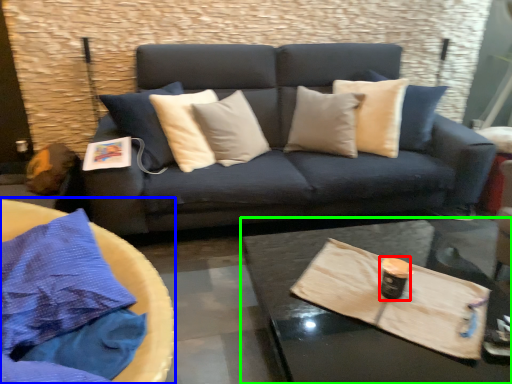
Question: Which object is the farthest from beverage (highlighted by a red box)? Choose among these: round table (highlighted by a blue box) or coffee table (highlighted by a green box).

Choices:
 (A) round table
 (B) coffee table

Answer: (A)